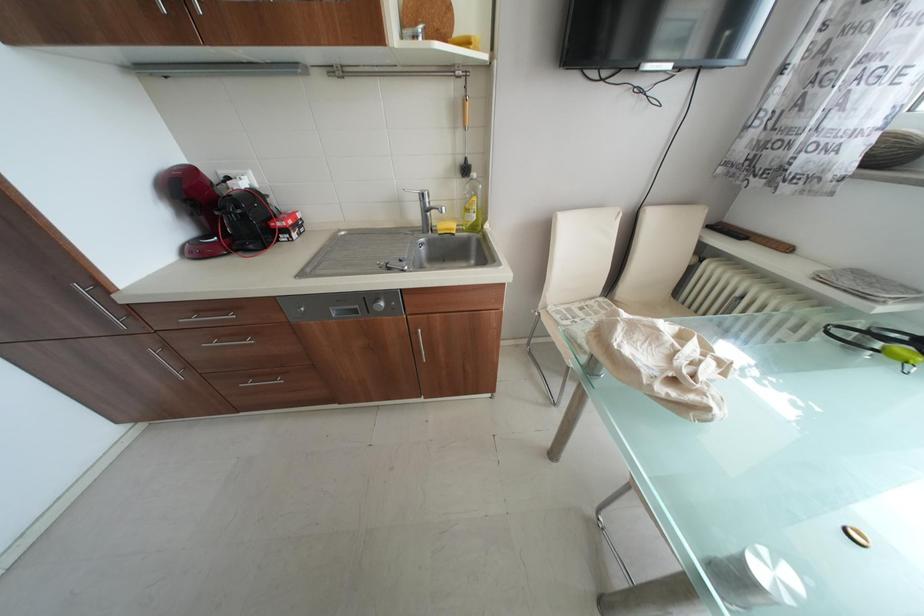
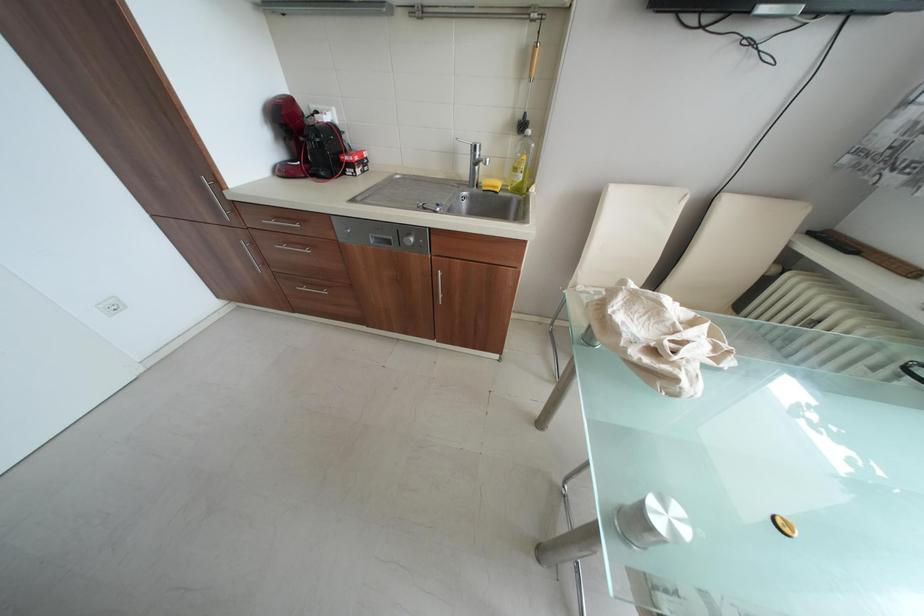
Question: Based on the continuous images, in which direction is the camera rotating? Reply with the corresponding letter.

Choices:
 (A) Left
 (B) Right
 (C) Up
 (D) Down

Answer: (A)